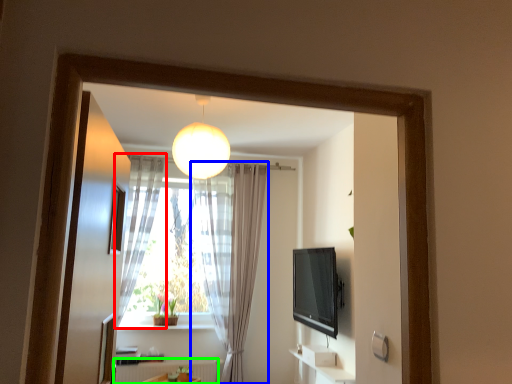
Question: Estimate the real-world distances between objects in this image. Which object is farther from curtain (highlighted by a red box), curtain (highlighted by a blue box) or radiator (highlighted by a green box)?

Choices:
 (A) curtain
 (B) radiator

Answer: (B)